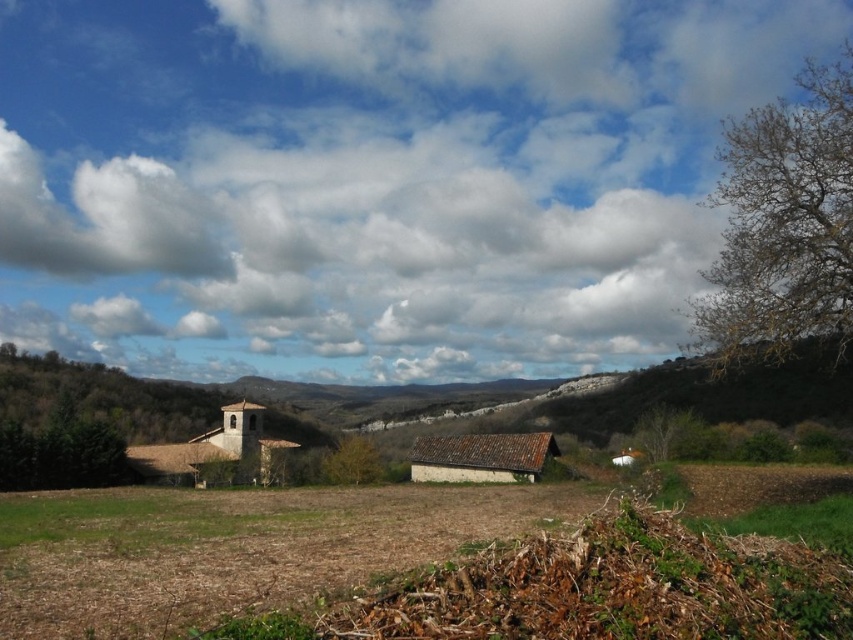
What is the 2D coordinate of the cloudy sky at upper center in the image?

The cloudy sky at upper center is located at the 2D coordinate point of (x=372, y=179).